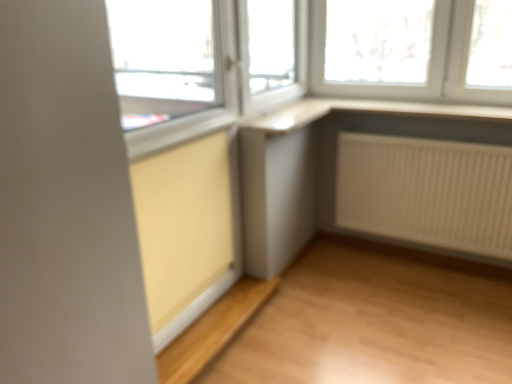
The width and height of the screenshot is (512, 384). Find the location of `white plastic radiator at lower right`. white plastic radiator at lower right is located at coordinates (426, 192).

What do you see at coordinates (426, 192) in the screenshot? The width and height of the screenshot is (512, 384). I see `white plastic radiator at lower right` at bounding box center [426, 192].

Measure the distance between white plastic radiator at lower right and camera.

2.16 meters.

Image resolution: width=512 pixels, height=384 pixels. I want to click on white plastic radiator at lower right, so click(x=426, y=192).